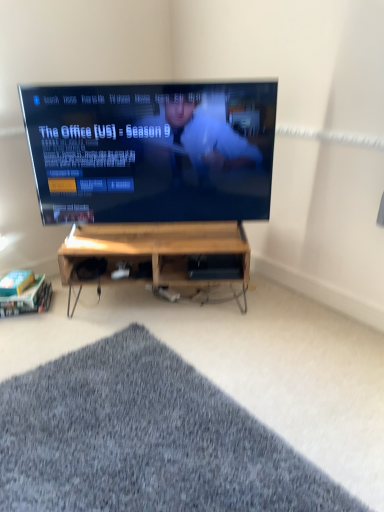
Question: From the image's perspective, is wooden at center, positioned as the first shelf in top-to-bottom order, under woodenmaterial/texturedesk at center?

Choices:
 (A) no
 (B) yes

Answer: (A)

Question: Is wooden at center, which is the 2th shelf in left-to-right order, shorter than woodenmaterial/texturedesk at center?

Choices:
 (A) yes
 (B) no

Answer: (A)

Question: Does wooden at center, acting as the second shelf starting from the bottom, appear on the left side of woodenmaterial/texturedesk at center?

Choices:
 (A) no
 (B) yes

Answer: (A)

Question: From the image's perspective, is wooden at center, positioned as the first shelf in top-to-bottom order, above woodenmaterial/texturedesk at center?

Choices:
 (A) yes
 (B) no

Answer: (A)

Question: Is wooden at center, positioned as the 1th shelf in right-to-left order, outside of woodenmaterial/texturedesk at center?

Choices:
 (A) yes
 (B) no

Answer: (B)

Question: Is wooden at center, positioned as the 1th shelf in right-to-left order, far away from woodenmaterial/texturedesk at center?

Choices:
 (A) no
 (B) yes

Answer: (A)

Question: Is woodenmaterial/textureshelf at lower left, which is the first shelf from bottom to top, far away from wooden at center, which is the 2th shelf in left-to-right order?

Choices:
 (A) no
 (B) yes

Answer: (A)

Question: Is wooden at center, acting as the second shelf starting from the bottom, a part of woodenmaterial/textureshelf at lower left, which is the first shelf from bottom to top?

Choices:
 (A) yes
 (B) no

Answer: (B)

Question: Does woodenmaterial/textureshelf at lower left, positioned as the 2th shelf in right-to-left order, come in front of wooden at center, positioned as the first shelf in top-to-bottom order?

Choices:
 (A) no
 (B) yes

Answer: (A)

Question: Is woodenmaterial/textureshelf at lower left, acting as the second shelf starting from the top, facing away from wooden at center, which is the 2th shelf in left-to-right order?

Choices:
 (A) no
 (B) yes

Answer: (A)

Question: Is woodenmaterial/textureshelf at lower left, positioned as the 2th shelf in right-to-left order, positioned behind wooden at center, positioned as the first shelf in top-to-bottom order?

Choices:
 (A) no
 (B) yes

Answer: (B)

Question: Does woodenmaterial/textureshelf at lower left, which is the first shelf from bottom to top, touch wooden at center, which is the 2th shelf in left-to-right order?

Choices:
 (A) yes
 (B) no

Answer: (B)

Question: Is woodenmaterial/texturedesk at center oriented towards wooden at center, acting as the second shelf starting from the bottom?

Choices:
 (A) no
 (B) yes

Answer: (B)